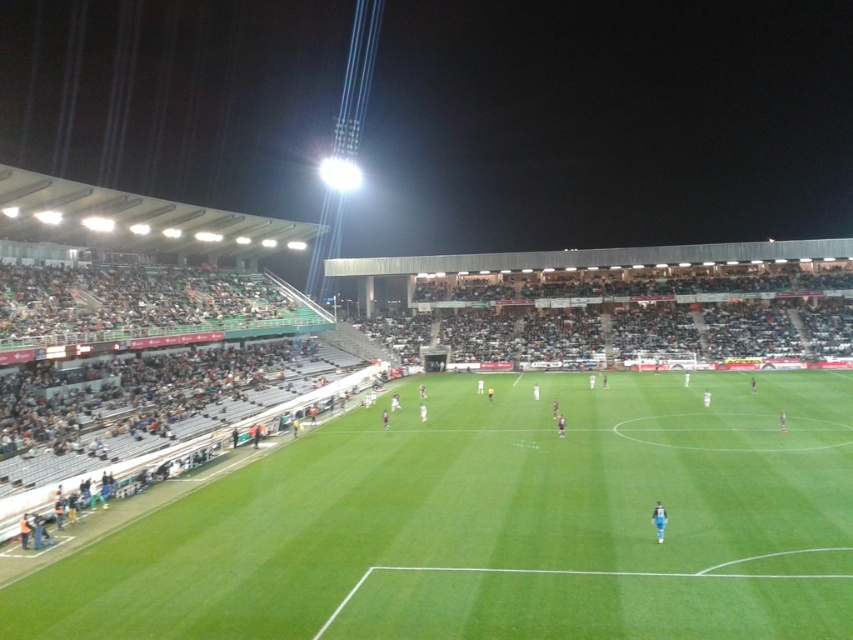
Is green grass football field at center wider than blue fabric person at center?

Yes.

In order to click on green grass football field at center in this screenshot , I will do `click(498, 524)`.

Between point (83, 573) and point (660, 504), which one is positioned behind?

Point (660, 504)

Where is `green grass football field at center`? This screenshot has height=640, width=853. green grass football field at center is located at coordinates (498, 524).